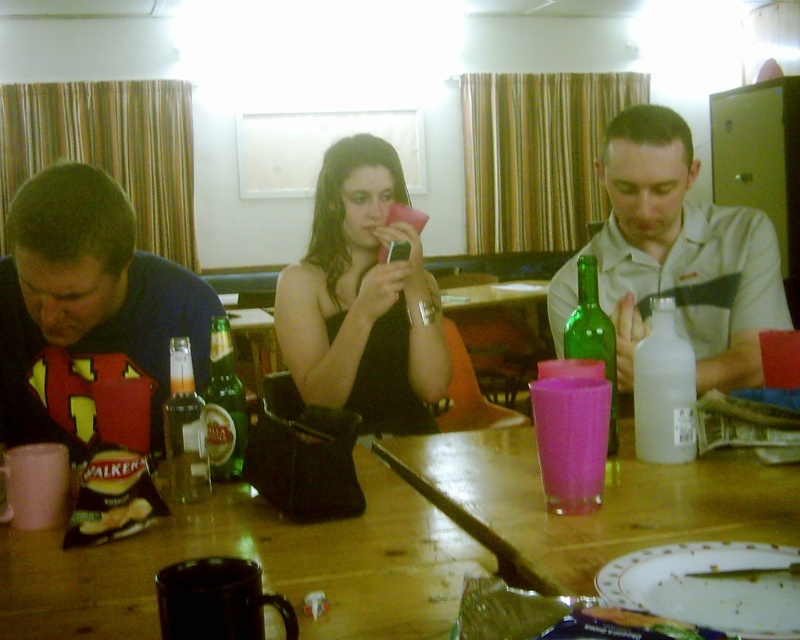
You are a server in a ship dining area and need to place a 10 inch long tray between the matte white bottle at center right and the green glass bottle at center. Can you fit the tray there without moving either bottle?

The distance between the matte white bottle at center right and the green glass bottle at center is 10.53 inches. Since the tray is 10 inches long, it can fit between them as the space available is slightly larger than the tray.

You are a bartender preparing drinks for a party. You have a matte white bottle at center right and a green glass bottle at center on the table. Which bottle should you choose if you need a wider container to mix ingredients?

The matte white bottle at center right might be wider than the green glass bottle at center, so you should choose the matte white bottle at center right for mixing ingredients.

From the picture: You are standing in the dining area of a ship and want to reach the point marked as point (614, 461). If your reach is 1 meter, can you grab something at that point without moving your feet?

The distance between you and point (614, 461) is 1.17 meters, which is beyond your 1 meter reach. You cannot grab it without moving.